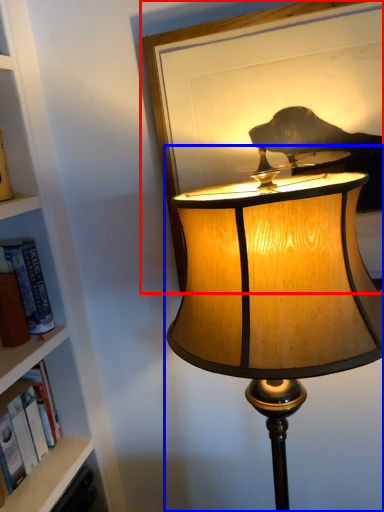
Question: Among these objects, which one is farthest to the camera, picture frame (highlighted by a red box) or lamp (highlighted by a blue box)?

Choices:
 (A) picture frame
 (B) lamp

Answer: (A)